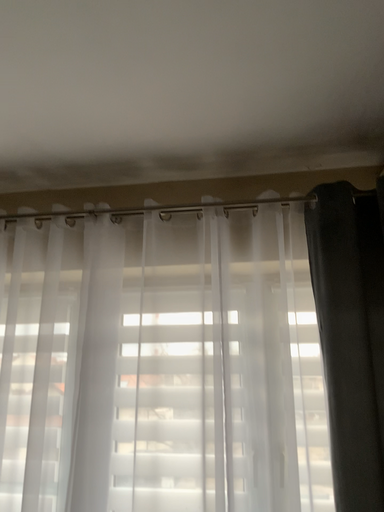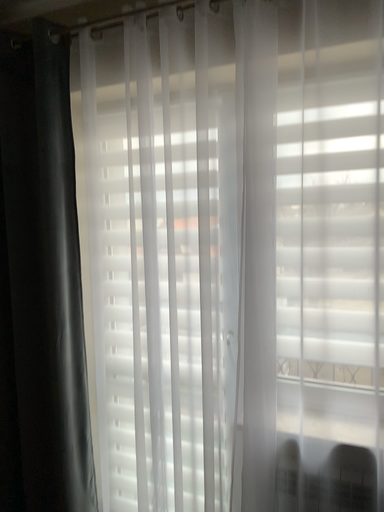
Question: Which way did the camera rotate in the video?

Choices:
 (A) rotated right
 (B) rotated left

Answer: (B)